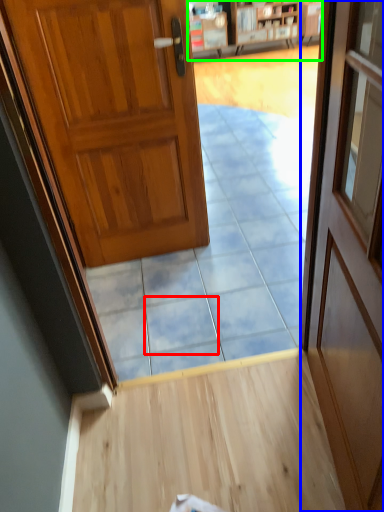
Question: Based on their relative distances, which object is nearer to tile (highlighted by a red box)? Choose from door (highlighted by a blue box) and bookshelf (highlighted by a green box).

Choices:
 (A) door
 (B) bookshelf

Answer: (A)